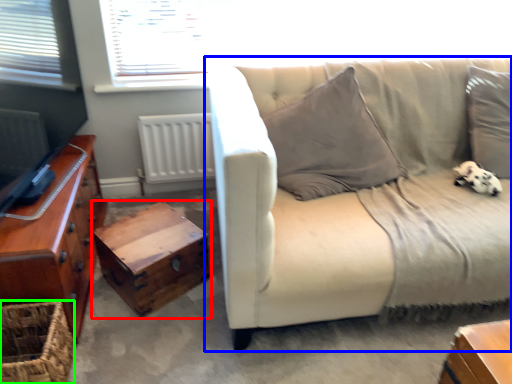
Question: Based on their relative distances, which object is farther from table (highlighted by a red box)? Choose from studio couch (highlighted by a blue box) and basket (highlighted by a green box).

Choices:
 (A) studio couch
 (B) basket

Answer: (A)